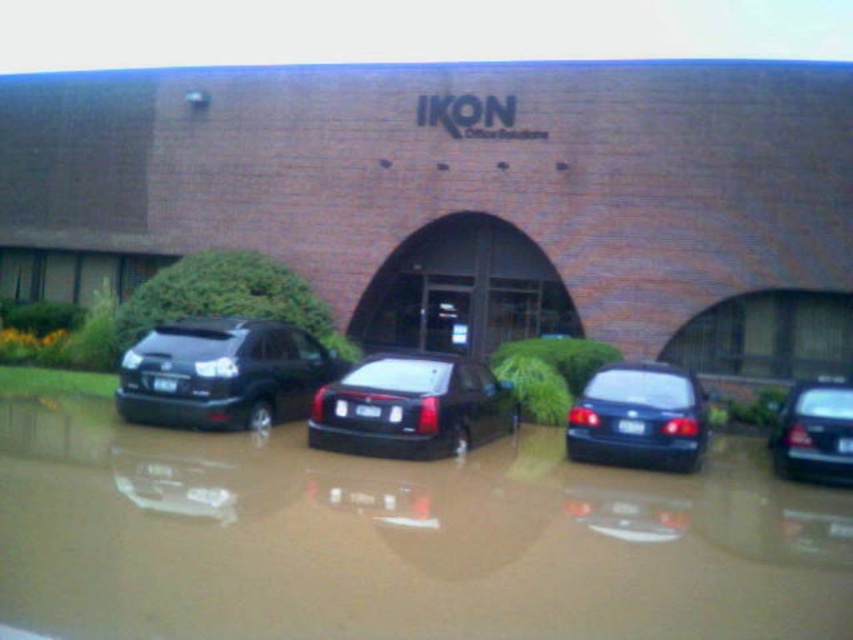
You are standing in the flooded parking lot in front of the IKON Office Solutions building. You see two points marked in the image. The first point is at coordinates point (192,422) and the second is at point (788,403). Which point is closer to you?

Point (192,422) is closer to the viewer than point (788,403).

You are a tow truck driver trying to rescue vehicles from the flooded parking lot. You see the matte black suv at left and the shiny black sedan at right. Which vehicle should you tow first if you want to start with the one closer to the entrance of IKON Office Solutions?

The shiny black sedan at right is closer to the entrance of IKON Office Solutions because the matte black suv at left is positioned on the left side of it, meaning the sedan is nearer to the entrance.

You are a tow truck operator assessing the flooded parking lot. You need to tow both the glossy black sedan at center and the shiny black sedan at right. Which vehicle should you tow first if you want to tow the larger one first?

The glossy black sedan at center is larger in size than the shiny black sedan at right, so you should tow the glossy black sedan at center first.